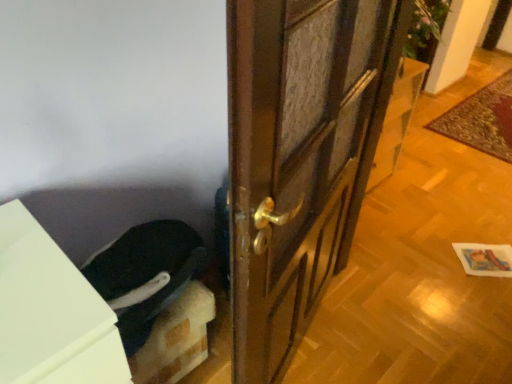
You are a GUI agent. You are given a task and a screenshot of the screen. Output one action in this format:
    pyautogui.click(x=<x>, y=<y>)
    Task: Click on the carpeted mat at right
    This screenshot has height=384, width=512.
    Given the screenshot: What is the action you would take?
    pyautogui.click(x=482, y=119)

Where is `dark blue fabric at lower left`? This screenshot has height=384, width=512. dark blue fabric at lower left is located at coordinates (145, 274).

Locate an element on the screen. Image resolution: width=512 pixels, height=384 pixels. carpeted mat at right is located at coordinates (482, 119).

Considering the positions of objects white matte cabinet at lower left and carpeted mat at right in the image provided, who is behind, white matte cabinet at lower left or carpeted mat at right?

carpeted mat at right is further away from the camera.

How many degrees apart are the facing directions of white matte cabinet at lower left and carpeted mat at right?

89.4 degrees separate the facing orientations of white matte cabinet at lower left and carpeted mat at right.

Can you confirm if white matte cabinet at lower left is taller than carpeted mat at right?

Correct, white matte cabinet at lower left is much taller as carpeted mat at right.

Is there a large distance between white matte cabinet at lower left and carpeted mat at right?

Yes, white matte cabinet at lower left and carpeted mat at right are located far from each other.

From a real-world perspective, between white matte cabinet at lower left and brown wooden door at center, who is vertically lower?

brown wooden door at center is physically lower.

Which is less distant, (31, 308) or (234, 138)?

The point (234, 138) is closer.

Based on their sizes in the image, would you say white matte cabinet at lower left is bigger or smaller than brown wooden door at center?

In the image, white matte cabinet at lower left appears to be smaller than brown wooden door at center.

From a real-world perspective, is carpeted mat at right physically located above or below dark blue fabric at lower left?

From a real-world perspective, carpeted mat at right is physically below dark blue fabric at lower left.

Which of these two, carpeted mat at right or dark blue fabric at lower left, is smaller?

Smaller between the two is dark blue fabric at lower left.

Considering the relative positions of carpeted mat at right and dark blue fabric at lower left in the image provided, is carpeted mat at right to the left of dark blue fabric at lower left from the viewer's perspective?

No.

This screenshot has height=384, width=512. Find the location of `laundry above the carpeted mat at right (from a real-world perspective)`. laundry above the carpeted mat at right (from a real-world perspective) is located at coordinates (145, 274).

Is dark blue fabric at lower left turned away from white matte cabinet at lower left?

No, dark blue fabric at lower left's orientation is not away from white matte cabinet at lower left.

Between dark blue fabric at lower left and white matte cabinet at lower left, which one appears on the right side from the viewer's perspective?

Positioned to the right is dark blue fabric at lower left.

Locate an element on the screen. cabinetry below the dark blue fabric at lower left (from the image's perspective) is located at coordinates (51, 312).

From the image's perspective, is dark blue fabric at lower left located above white matte cabinet at lower left?

Correct, dark blue fabric at lower left appears higher than white matte cabinet at lower left in the image.

I want to click on doormat that appears below the white matte cabinet at lower left (from a real-world perspective), so click(x=482, y=119).

Looking at this image, between carpeted mat at right and white matte cabinet at lower left, which one has less height?

carpeted mat at right is shorter.

How different are the orientations of carpeted mat at right and white matte cabinet at lower left in degrees?

carpeted mat at right and white matte cabinet at lower left are facing 89.4 degrees away from each other.

Is carpeted mat at right at the left side of white matte cabinet at lower left?

No, carpeted mat at right is not to the left of white matte cabinet at lower left.

Looking at this image, does dark blue fabric at lower left have a lesser width compared to brown wooden door at center?

Correct, the width of dark blue fabric at lower left is less than that of brown wooden door at center.

From a real-world perspective, is dark blue fabric at lower left above or below brown wooden door at center?

Clearly, from a real-world perspective, dark blue fabric at lower left is above brown wooden door at center.

Is dark blue fabric at lower left to the right of brown wooden door at center from the viewer's perspective?

Incorrect, dark blue fabric at lower left is not on the right side of brown wooden door at center.

Considering the sizes of objects dark blue fabric at lower left and brown wooden door at center in the image provided, who is shorter, dark blue fabric at lower left or brown wooden door at center?

brown wooden door at center.

Is brown wooden door at center positioned far away from carpeted mat at right?

Absolutely, brown wooden door at center is distant from carpeted mat at right.

How many degrees apart are the facing directions of brown wooden door at center and carpeted mat at right?

The angular difference between brown wooden door at center and carpeted mat at right is 8.65e-05 degrees.

Between point (277, 67) and point (476, 102), which one is positioned in front?

The point (277, 67) is in front.

Is the position of brown wooden door at center less distant than that of carpeted mat at right?

Yes, brown wooden door at center is in front of carpeted mat at right.

Where is `doormat on the right of white matte cabinet at lower left`? The height and width of the screenshot is (384, 512). doormat on the right of white matte cabinet at lower left is located at coordinates (482, 119).

At what (x,y) coordinates should I click in order to perform the action: click on cabinetry above the brown wooden door at center (from a real-world perspective). Please return your answer as a coordinate pair (x, y). The width and height of the screenshot is (512, 384). Looking at the image, I should click on (51, 312).

When comparing their distances from carpeted mat at right, does brown wooden door at center or dark blue fabric at lower left seem further?

dark blue fabric at lower left.

Considering their positions, is dark blue fabric at lower left positioned further to brown wooden door at center than carpeted mat at right?

Among the two, carpeted mat at right is located further to brown wooden door at center.

Based on their spatial positions, is dark blue fabric at lower left or white matte cabinet at lower left closer to brown wooden door at center?

dark blue fabric at lower left is positioned closer to the anchor brown wooden door at center.

Consider the image. Looking at the image, which one is located further to white matte cabinet at lower left, dark blue fabric at lower left or carpeted mat at right?

carpeted mat at right.

From the image, which object appears to be farther from dark blue fabric at lower left, carpeted mat at right or brown wooden door at center?

carpeted mat at right is further to dark blue fabric at lower left.

Based on the photo, from the image, which object appears to be farther from dark blue fabric at lower left, white matte cabinet at lower left or carpeted mat at right?

The object further to dark blue fabric at lower left is carpeted mat at right.

Looking at the image, which one is located closer to brown wooden door at center, carpeted mat at right or dark blue fabric at lower left?

Based on the image, dark blue fabric at lower left appears to be nearer to brown wooden door at center.

When comparing their distances from brown wooden door at center, does white matte cabinet at lower left or carpeted mat at right seem closer?

white matte cabinet at lower left is closer to brown wooden door at center.

Where is `door between white matte cabinet at lower left and carpeted mat at right from left to right`? door between white matte cabinet at lower left and carpeted mat at right from left to right is located at coordinates (298, 157).

Locate an element on the screen. The width and height of the screenshot is (512, 384). laundry between white matte cabinet at lower left and brown wooden door at center from left to right is located at coordinates (145, 274).

Where is `laundry between white matte cabinet at lower left and carpeted mat at right from left to right`? The width and height of the screenshot is (512, 384). laundry between white matte cabinet at lower left and carpeted mat at right from left to right is located at coordinates (145, 274).

What are the coordinates of `door between dark blue fabric at lower left and carpeted mat at right` in the screenshot? It's located at (298, 157).